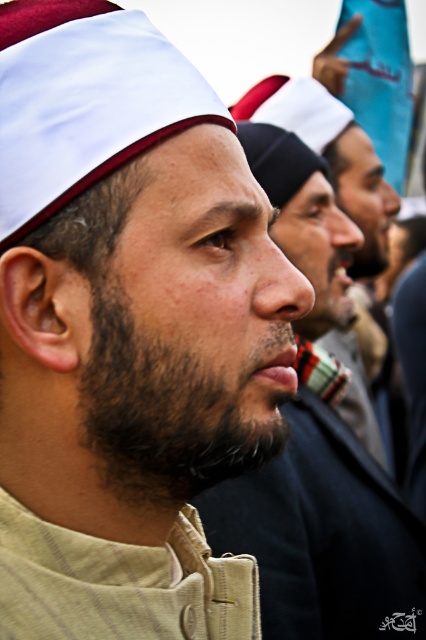
Question: Which point appears closest to the camera in this image?

Choices:
 (A) (26, 218)
 (B) (293, 465)
 (C) (166, 500)

Answer: (A)

Question: Which of the following is the farthest from the observer?

Choices:
 (A) beige fabric headscarf at center
 (B) beige fabric cap at center
 (C) dark brown fuzzy beard at center

Answer: (A)

Question: Where is beige fabric cap at center located in relation to dark brown fuzzy beard at center in the image?

Choices:
 (A) below
 (B) above

Answer: (B)

Question: Which point is closer to the camera?

Choices:
 (A) (411, 524)
 (B) (169, 68)
 (C) (140, 397)

Answer: (C)

Question: Does beige fabric cap at center have a smaller size compared to beige fabric headscarf at center?

Choices:
 (A) no
 (B) yes

Answer: (B)

Question: Observing the image, what is the correct spatial positioning of beige fabric cap at center in reference to dark brown fuzzy beard at center?

Choices:
 (A) above
 (B) below

Answer: (A)